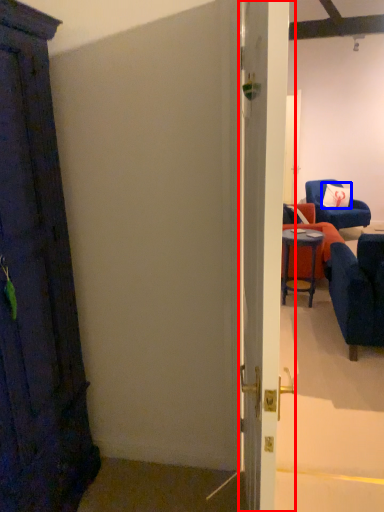
Question: Which object is closer to the camera taking this photo, door (highlighted by a red box) or pillow (highlighted by a blue box)?

Choices:
 (A) door
 (B) pillow

Answer: (A)